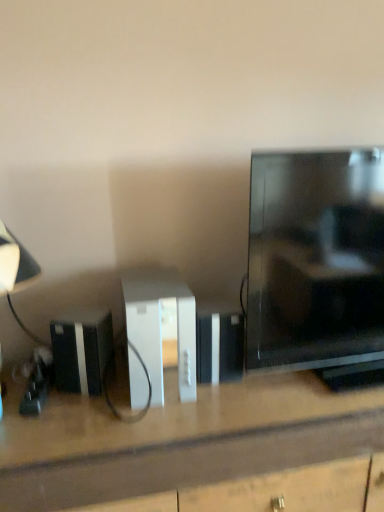
This screenshot has width=384, height=512. What do you see at coordinates (16, 270) in the screenshot?
I see `matte black lampshade at left` at bounding box center [16, 270].

This screenshot has height=512, width=384. I want to click on white plastic console at center, so click(160, 329).

Image resolution: width=384 pixels, height=512 pixels. Describe the element at coordinates (317, 264) in the screenshot. I see `black glossy tv at right` at that location.

Locate an element on the screen. The height and width of the screenshot is (512, 384). matte black lampshade at left is located at coordinates (16, 270).

From a real-world perspective, which object stands above the other?

matte black lampshade at left.

Which is behind, white matte desk at center or matte black lampshade at left?

matte black lampshade at left.

Considering the sizes of objects white matte desk at center and matte black lampshade at left in the image provided, who is bigger, white matte desk at center or matte black lampshade at left?

With larger size is white matte desk at center.

From the image's perspective, which one is positioned lower, white matte desk at center or matte black lampshade at left?

white matte desk at center appears lower in the image.

Can you tell me how much matte black lampshade at left and white plastic console at center differ in facing direction?

matte black lampshade at left and white plastic console at center are facing 0.572 degrees away from each other.

Is there a large distance between matte black lampshade at left and white plastic console at center?

They are positioned close to each other.

Between point (16, 238) and point (130, 311), which one is positioned behind?

The point (16, 238) is farther from the camera.

From a real-world perspective, between black glossy tv at right and matte black lampshade at left, who is vertically lower?

From a 3D spatial view, matte black lampshade at left is below.

Between black glossy tv at right and matte black lampshade at left, which one has larger size?

With larger size is black glossy tv at right.

From the image's perspective, which is above, black glossy tv at right or matte black lampshade at left?

black glossy tv at right, from the image's perspective.

Consider the image. Considering the relative sizes of black glossy tv at right and matte black lampshade at left in the image provided, is black glossy tv at right shorter than matte black lampshade at left?

No.

Can you confirm if black glossy tv at right is bigger than white matte desk at center?

Actually, black glossy tv at right might be smaller than white matte desk at center.

Is point (252, 245) positioned before point (308, 447)?

No, (252, 245) is behind (308, 447).

Are black glossy tv at right and white matte desk at center located far from each other?

They are positioned close to each other.

From the image's perspective, is black glossy tv at right beneath white matte desk at center?

Actually, black glossy tv at right appears above white matte desk at center in the image.

From the image's perspective, between black glossy tv at right and white plastic console at center, which one is located above?

black glossy tv at right, from the image's perspective.

Would you say black glossy tv at right is a long distance from white plastic console at center?

No, there isn't a large distance between black glossy tv at right and white plastic console at center.

Considering the relative sizes of black glossy tv at right and white plastic console at center in the image provided, is black glossy tv at right thinner than white plastic console at center?

Yes.

Which is behind, point (82, 379) or point (135, 362)?

The point (82, 379) is farther.

Find the location of a particular element. appliance located underneath the white plastic console at center (from a real-world perspective) is located at coordinates (81, 350).

What's the angular difference between black plastic speaker at lower left and white plastic console at center's facing directions?

There is a 25.3-degree angle between the facing directions of black plastic speaker at lower left and white plastic console at center.

From a real-world perspective, between black plastic speaker at lower left and white plastic console at center, who is vertically higher?

white plastic console at center, from a real-world perspective.

Which of these two, black glossy tv at right or black plastic speaker at lower left, is thinner?

With smaller width is black plastic speaker at lower left.

In the scene shown: Can you confirm if black glossy tv at right is smaller than black plastic speaker at lower left?

Actually, black glossy tv at right might be larger than black plastic speaker at lower left.

From the image's perspective, would you say black glossy tv at right is shown under black plastic speaker at lower left?

Actually, black glossy tv at right appears above black plastic speaker at lower left in the image.

Find the location of a particular element. The image size is (384, 512). table lamp that is above the white matte desk at center (from a real-world perspective) is located at coordinates (16, 270).

Find the location of a particular element. The width and height of the screenshot is (384, 512). table lamp on the left of the white plastic console at center is located at coordinates (16, 270).

Looking at the image, which one is located further to black plastic speaker at lower left, white plastic console at center or black glossy tv at right?

black glossy tv at right lies further to black plastic speaker at lower left than the other object.

Which object lies further to the anchor point white matte desk at center, white plastic console at center or black glossy tv at right?

Based on the image, black glossy tv at right appears to be further to white matte desk at center.

Estimate the real-world distances between objects in this image. Which object is closer to black glossy tv at right, matte black lampshade at left or black plastic speaker at lower left?

black plastic speaker at lower left is positioned closer to the anchor black glossy tv at right.

Which object lies further to the anchor point white plastic console at center, matte black lampshade at left or white matte desk at center?

matte black lampshade at left is positioned further to the anchor white plastic console at center.

Based on their spatial positions, is white plastic console at center or matte black lampshade at left further from white matte desk at center?

matte black lampshade at left lies further to white matte desk at center than the other object.

From the image, which object appears to be nearer to black plastic speaker at lower left, black glossy tv at right or white plastic console at center?

white plastic console at center is closer to black plastic speaker at lower left.

From the image, which object appears to be farther from matte black lampshade at left, white matte desk at center or white plastic console at center?

white matte desk at center lies further to matte black lampshade at left than the other object.

Looking at the image, which one is located closer to white matte desk at center, white plastic console at center or black plastic speaker at lower left?

white plastic console at center lies closer to white matte desk at center than the other object.

Where is `desk located between matte black lampshade at left and black glossy tv at right in the left-right direction`? desk located between matte black lampshade at left and black glossy tv at right in the left-right direction is located at coordinates (179, 439).

Find the location of a particular element. The width and height of the screenshot is (384, 512). cabinetry located between black plastic speaker at lower left and black glossy tv at right in the left-right direction is located at coordinates (160, 329).

At what (x,y) coordinates should I click in order to perform the action: click on appliance situated between matte black lampshade at left and black glossy tv at right from left to right. Please return your answer as a coordinate pair (x, y). Looking at the image, I should click on (81, 350).

This screenshot has width=384, height=512. I want to click on cabinetry between black glossy tv at right and white matte desk at center from top to bottom, so click(x=160, y=329).